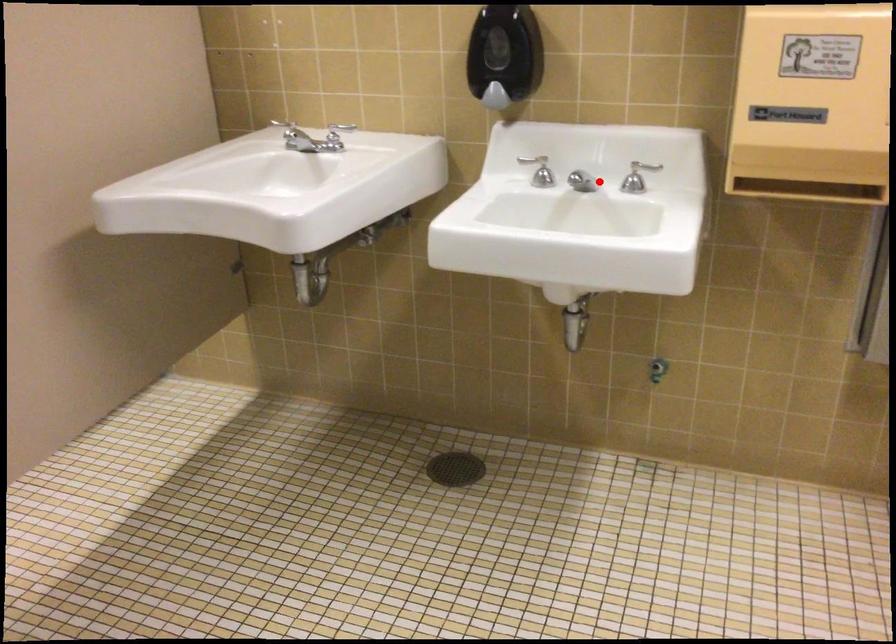
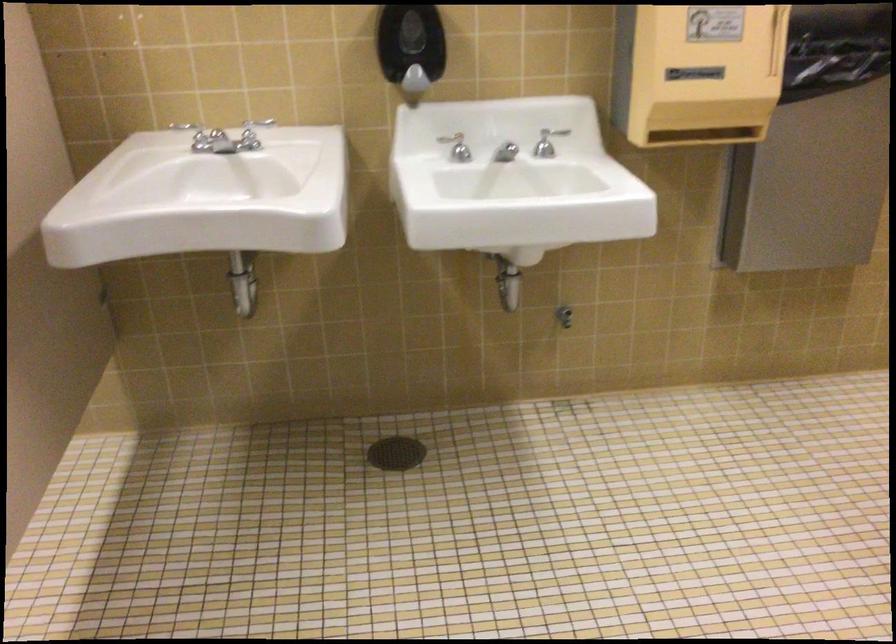
Where in the second image is the point corresponding to the highlighted location from the first image?

(505, 152)